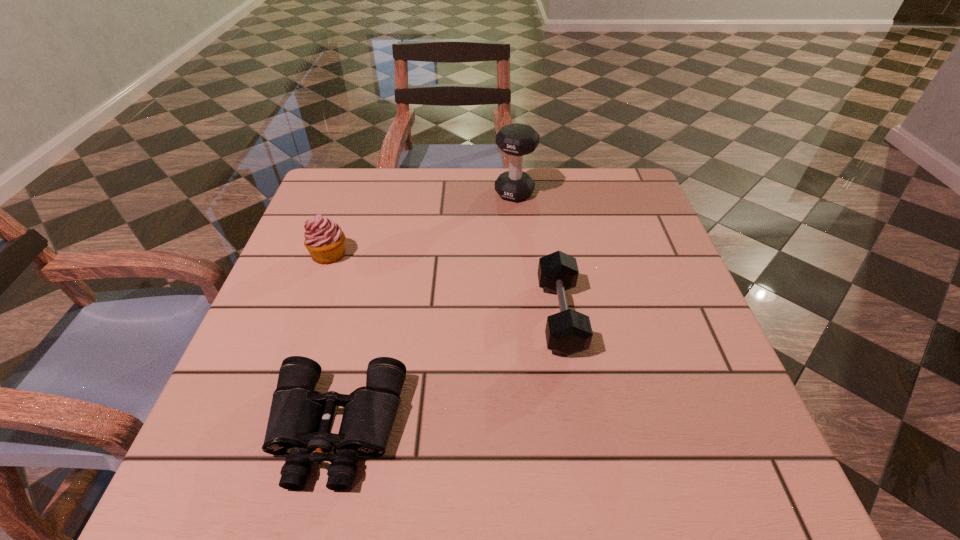
Locate an element on the screen. The image size is (960, 540). the taller dumbbell is located at coordinates (516, 140).

Find the location of a particular element. Image resolution: width=960 pixels, height=540 pixels. the tallest object is located at coordinates (516, 140).

You are a GUI agent. You are given a task and a screenshot of the screen. Output one action in this format:
    pyautogui.click(x=<x>, y=<y>)
    Task: Click on the third nearest object
    
    Given the screenshot: What is the action you would take?
    pyautogui.click(x=324, y=239)

This screenshot has width=960, height=540. Find the location of `cupcake`. cupcake is located at coordinates click(x=324, y=239).

Identify the location of the nearer dumbbell. This screenshot has width=960, height=540. coord(568,332).

At what (x,y) coordinates should I click in order to perform the action: click on the second shortest object. Please return your answer as a coordinate pair (x, y). This screenshot has width=960, height=540. Looking at the image, I should click on (568, 332).

Where is `the shortest object`? This screenshot has width=960, height=540. the shortest object is located at coordinates (300, 418).

You are a GUI agent. You are given a task and a screenshot of the screen. Output one action in this format:
    pyautogui.click(x=<x>, y=<y>)
    Task: Click on the binoculars
    
    Given the screenshot: What is the action you would take?
    coord(300,418)

You are a GUI agent. You are given a task and a screenshot of the screen. Output one action in this format:
    pyautogui.click(x=<x>, y=<y>)
    Task: Click on the vacant space located 0.050m on the back of the tallest object
    The width and height of the screenshot is (960, 540).
    Given the screenshot: What is the action you would take?
    pyautogui.click(x=513, y=172)

Where is `free region located on the front of the third shortest object`? The image size is (960, 540). free region located on the front of the third shortest object is located at coordinates (274, 410).